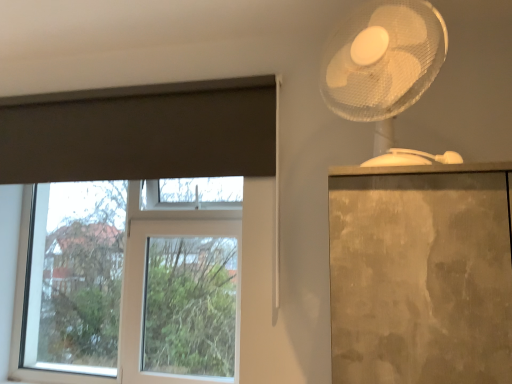
Question: Considering the relative positions of dark gray matte curtain at upper left and clear glass window at left in the image provided, is dark gray matte curtain at upper left to the left of clear glass window at left from the viewer's perspective?

Choices:
 (A) yes
 (B) no

Answer: (B)

Question: From the image's perspective, does dark gray matte curtain at upper left appear higher than clear glass window at left?

Choices:
 (A) no
 (B) yes

Answer: (B)

Question: Does dark gray matte curtain at upper left have a lesser height compared to clear glass window at left?

Choices:
 (A) yes
 (B) no

Answer: (A)

Question: Does dark gray matte curtain at upper left lie behind clear glass window at left?

Choices:
 (A) yes
 (B) no

Answer: (B)

Question: Considering the relative sizes of dark gray matte curtain at upper left and clear glass window at left in the image provided, is dark gray matte curtain at upper left thinner than clear glass window at left?

Choices:
 (A) no
 (B) yes

Answer: (B)

Question: Is dark gray matte curtain at upper left facing away from clear glass window at left?

Choices:
 (A) no
 (B) yes

Answer: (A)

Question: Can you confirm if white plastic fan at upper right is smaller than dark gray matte curtain at upper left?

Choices:
 (A) yes
 (B) no

Answer: (A)

Question: Can you confirm if white plastic fan at upper right is positioned to the left of dark gray matte curtain at upper left?

Choices:
 (A) no
 (B) yes

Answer: (A)

Question: Is white plastic fan at upper right turned away from dark gray matte curtain at upper left?

Choices:
 (A) yes
 (B) no

Answer: (B)

Question: Is white plastic fan at upper right positioned far away from dark gray matte curtain at upper left?

Choices:
 (A) yes
 (B) no

Answer: (B)

Question: Is white plastic fan at upper right closer to camera compared to dark gray matte curtain at upper left?

Choices:
 (A) yes
 (B) no

Answer: (A)

Question: Considering the relative sizes of white plastic fan at upper right and dark gray matte curtain at upper left in the image provided, is white plastic fan at upper right shorter than dark gray matte curtain at upper left?

Choices:
 (A) yes
 (B) no

Answer: (B)

Question: Considering the relative sizes of clear glass window at left and white plastic fan at upper right in the image provided, is clear glass window at left taller than white plastic fan at upper right?

Choices:
 (A) no
 (B) yes

Answer: (B)